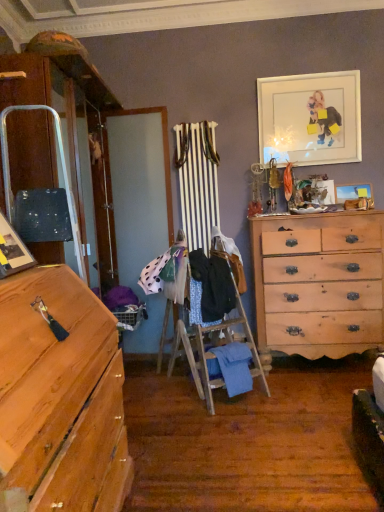
Question: From a real-world perspective, is blue textured fabric at center, which ranks as the 3th clothing in top-to-bottom order, positioned over matte black picture frame at left, placed as the 1th picture frame when sorted from left to right, based on gravity?

Choices:
 (A) no
 (B) yes

Answer: (A)

Question: From the image's perspective, would you say blue textured fabric at center, the 2th clothing positioned from the bottom, is positioned over matte black picture frame at left, which is the 1th picture frame from front to back?

Choices:
 (A) yes
 (B) no

Answer: (B)

Question: Is blue textured fabric at center, the 2th clothing positioned from the bottom, positioned with its back to matte black picture frame at left, which ranks as the first picture frame in bottom-to-top order?

Choices:
 (A) no
 (B) yes

Answer: (A)

Question: Considering the relative sizes of blue textured fabric at center, which ranks as the 3th clothing in top-to-bottom order, and matte black picture frame at left, which is the 1th picture frame from front to back, in the image provided, is blue textured fabric at center, which ranks as the 3th clothing in top-to-bottom order, bigger than matte black picture frame at left, which is the 1th picture frame from front to back,?

Choices:
 (A) no
 (B) yes

Answer: (A)

Question: Is blue textured fabric at center, which ranks as the 3th clothing in top-to-bottom order, positioned beyond the bounds of matte black picture frame at left, marked as the 3th picture frame in a right-to-left arrangement?

Choices:
 (A) yes
 (B) no

Answer: (A)

Question: Relative to wooden picture frame at upper right, which appears as the third picture frame when viewed from the front, is dark blue fabric at center, the third clothing in the bottom-to-top sequence, in front or behind?

Choices:
 (A) behind
 (B) front

Answer: (B)

Question: Does point (203, 320) appear closer or farther from the camera than point (337, 200)?

Choices:
 (A) closer
 (B) farther

Answer: (A)

Question: From a real-world perspective, is dark blue fabric at center, the 2th clothing from the top, physically located above or below wooden picture frame at upper right, which is the third picture frame in left-to-right order?

Choices:
 (A) below
 (B) above

Answer: (A)

Question: Is dark blue fabric at center, the third clothing in the bottom-to-top sequence, spatially inside wooden picture frame at upper right, placed as the 1th picture frame when sorted from right to left, or outside of it?

Choices:
 (A) inside
 (B) outside

Answer: (B)

Question: Is dark blue fabric at center, the third clothing in the bottom-to-top sequence, inside or outside of polka dot fabric at center, the 1th clothing viewed from the top?

Choices:
 (A) outside
 (B) inside

Answer: (A)

Question: In the image, is dark blue fabric at center, the 2th clothing from the top, on the left side or the right side of polka dot fabric at center, positioned as the 4th clothing in bottom-to-top order?

Choices:
 (A) left
 (B) right

Answer: (B)

Question: Is point (208, 320) positioned closer to the camera than point (157, 275)?

Choices:
 (A) closer
 (B) farther

Answer: (A)

Question: Based on their sizes in the image, would you say dark blue fabric at center, the 2th clothing from the top, is bigger or smaller than polka dot fabric at center, the 1th clothing viewed from the top?

Choices:
 (A) small
 (B) big

Answer: (B)

Question: Do you think matte black picture frame at left, which is the 1th picture frame from front to back, is within white matte picture frame at upper right, arranged as the 2th picture frame when viewed from the back, or outside of it?

Choices:
 (A) outside
 (B) inside

Answer: (A)

Question: Is matte black picture frame at left, which ranks as the first picture frame in bottom-to-top order, taller or shorter than white matte picture frame at upper right, positioned as the third picture frame in bottom-to-top order?

Choices:
 (A) short
 (B) tall

Answer: (A)